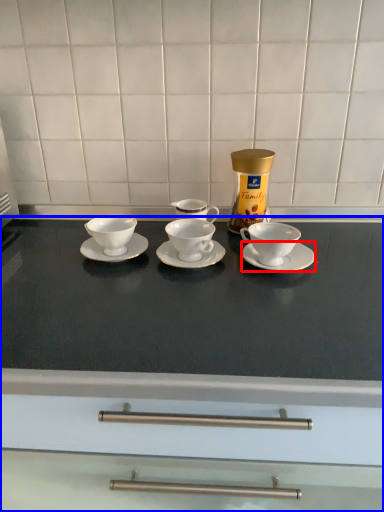
Question: Which of the following is the farthest to the observer, saucer (highlighted by a red box) or countertop (highlighted by a blue box)?

Choices:
 (A) saucer
 (B) countertop

Answer: (A)